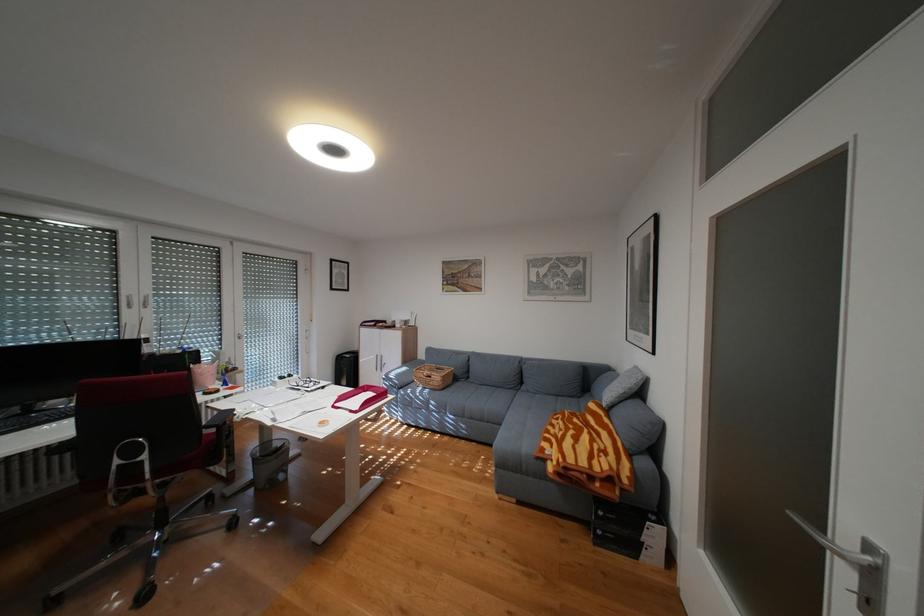
Identify the location of mesh trash can. The height and width of the screenshot is (616, 924). (271, 469).